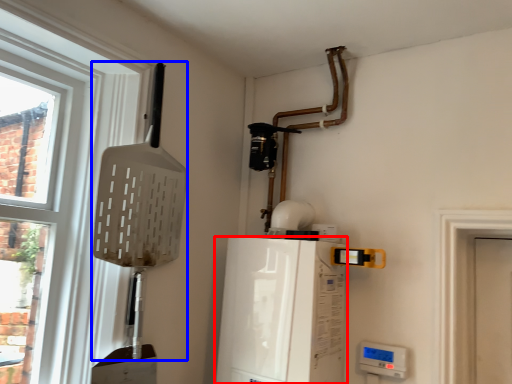
Question: Which point is closer to the camera, appliance (highlighted by a red box) or shovel (highlighted by a blue box)?

Choices:
 (A) appliance
 (B) shovel

Answer: (B)